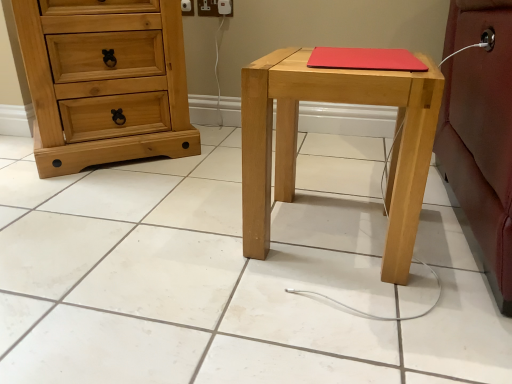
Image resolution: width=512 pixels, height=384 pixels. I want to click on vacant area on the back side of natural wood stool at center, so click(326, 178).